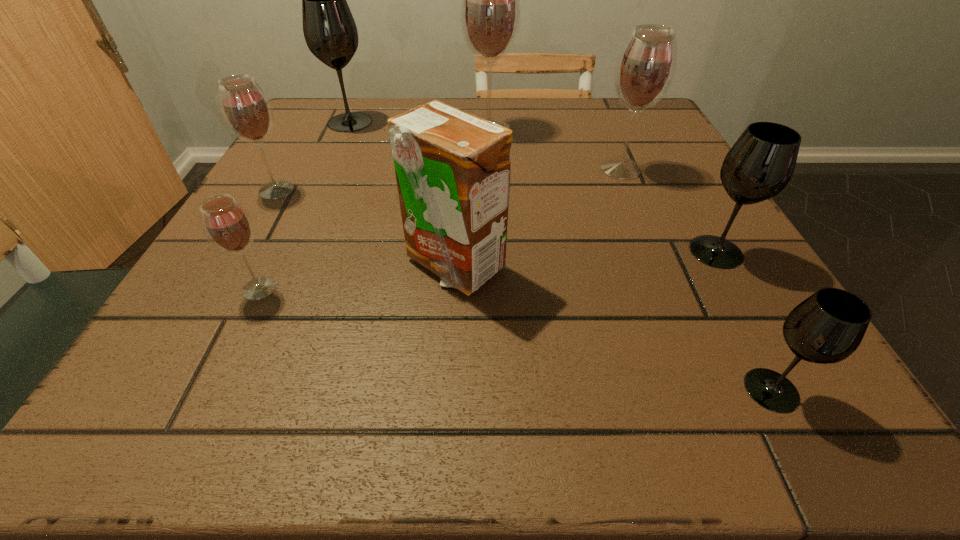
Where is `vacant space located 0.170m on the left of the smallest gray wineglass`? The height and width of the screenshot is (540, 960). vacant space located 0.170m on the left of the smallest gray wineglass is located at coordinates pyautogui.click(x=604, y=390).

You are a GUI agent. You are given a task and a screenshot of the screen. Output one action in this format:
    pyautogui.click(x=<x>, y=<y>)
    Task: Click on the object that is at the near edge
    The width and height of the screenshot is (960, 540).
    Given the screenshot: What is the action you would take?
    pyautogui.click(x=827, y=327)

You are a GUI agent. You are given a task and a screenshot of the screen. Output one action in this format:
    pyautogui.click(x=<x>, y=<y>)
    Task: Click on the object positioned at the far left corner
    The width and height of the screenshot is (960, 540).
    Given the screenshot: What is the action you would take?
    pyautogui.click(x=330, y=32)

The height and width of the screenshot is (540, 960). What are the coordinates of `object present at the near right corner` in the screenshot? It's located at (827, 327).

I want to click on vacant space at the far edge, so click(x=577, y=126).

This screenshot has width=960, height=540. I want to click on vacant space at the near edge of the desktop, so click(x=454, y=421).

Locate an element on the screen. The height and width of the screenshot is (540, 960). vacant space at the left edge of the desktop is located at coordinates (312, 161).

The width and height of the screenshot is (960, 540). In the image, there is a desktop. Identify the location of vacant area at the right edge. (720, 347).

You are a GUI agent. You are given a task and a screenshot of the screen. Output one action in this format:
    pyautogui.click(x=<x>, y=<y>)
    Task: Click on the vacant space at the far right corner
    
    Given the screenshot: What is the action you would take?
    pyautogui.click(x=654, y=135)

Locate an element on the screen. vacant space at the near right corner of the desktop is located at coordinates (707, 380).